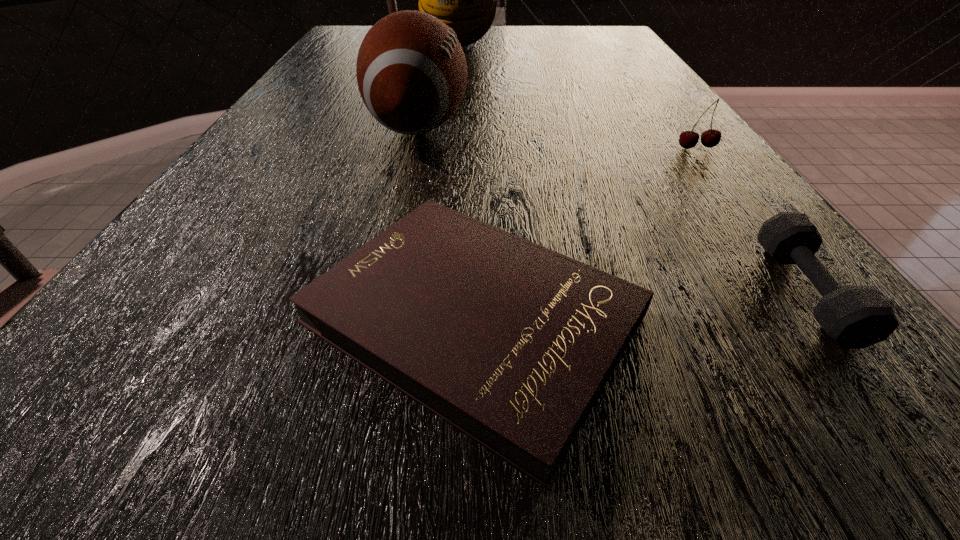
Identify the location of the farthest object. This screenshot has height=540, width=960. (465, 0).

This screenshot has width=960, height=540. In order to click on football in this screenshot , I will do `click(411, 70)`.

This screenshot has width=960, height=540. Find the location of `the third shortest object`. the third shortest object is located at coordinates (688, 139).

Find the location of a particular element. This screenshot has height=540, width=960. dumbbell is located at coordinates (855, 317).

I want to click on hardback book, so click(x=510, y=342).

This screenshot has width=960, height=540. What are the coordinates of `free space located 0.360m on the surface of the farthest object near the brand logo` in the screenshot? It's located at (451, 111).

Where is `free point located on the laces of the football`? The image size is (960, 540). free point located on the laces of the football is located at coordinates (549, 125).

Find the location of a particular element. This screenshot has width=960, height=540. vacant region located 0.300m on the surface of the third shortest object is located at coordinates (783, 261).

Locate an element on the screen. free region located on the back of the fourth tallest object is located at coordinates (719, 178).

Image resolution: width=960 pixels, height=540 pixels. In order to click on vacant position located 0.230m on the right of the hardback book in this screenshot , I will do `click(849, 318)`.